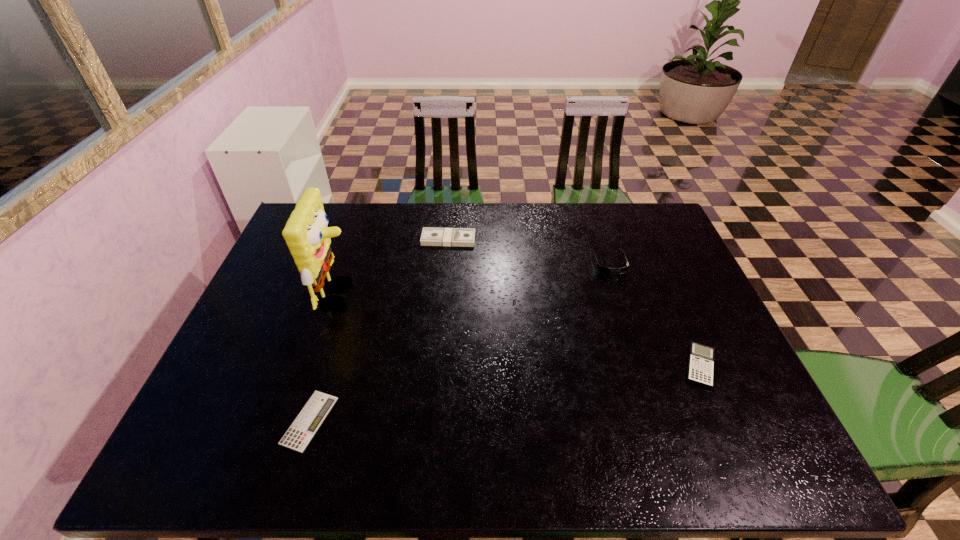
Image resolution: width=960 pixels, height=540 pixels. In order to click on sponge in this screenshot , I will do `click(307, 236)`.

Locate an element on the screen. This screenshot has height=540, width=960. the fourth shortest object is located at coordinates (604, 270).

Locate an element on the screen. The image size is (960, 540). the second object from right to left is located at coordinates (604, 270).

At what (x,y) coordinates should I click in order to perform the action: click on dollar. Please return your answer as a coordinate pair (x, y). Looking at the image, I should click on (461, 237).

Where is `the third object from right to left`? This screenshot has width=960, height=540. the third object from right to left is located at coordinates (461, 237).

Locate an element on the screen. the rightmost object is located at coordinates (701, 357).

You are a GUI agent. You are given a task and a screenshot of the screen. Output one action in this format:
    pyautogui.click(x=<x>, y=<y>)
    Task: Click on the right calculator
    Image resolution: width=960 pixels, height=540 pixels.
    Given the screenshot: What is the action you would take?
    pyautogui.click(x=701, y=357)

You are a GUI agent. You are given a task and a screenshot of the screen. Output one action in this format:
    pyautogui.click(x=<x>, y=<y>)
    Task: Click on the left calculator
    Image resolution: width=960 pixels, height=540 pixels.
    Given the screenshot: What is the action you would take?
    pyautogui.click(x=301, y=432)

Locate an element on the screen. Image resolution: width=960 pixels, height=540 pixels. the shorter calculator is located at coordinates (301, 432).

Locate an element on the screen. The height and width of the screenshot is (540, 960). vacant region located 0.220m on the face of the sponge is located at coordinates (435, 294).